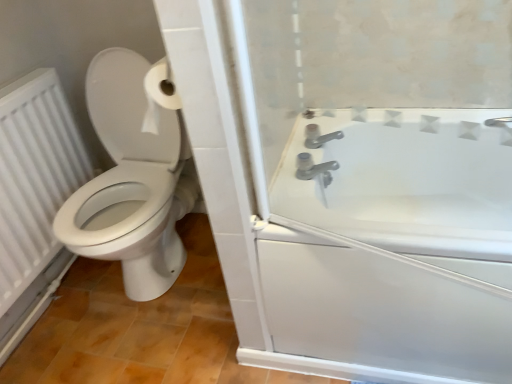
Measure the distance between satin nickel faucet at upper right and camera.

satin nickel faucet at upper right and camera are 4.01 feet apart.

Where is `satin nickel faucet at upper right`? satin nickel faucet at upper right is located at coordinates (314, 168).

From a real-world perspective, does white glossy bathtub at right sit lower than satin nickel faucet at upper right?

Yes, from a real-world perspective, white glossy bathtub at right is beneath satin nickel faucet at upper right.

At what (x,y) coordinates should I click in order to perform the action: click on screen door that appears below the satin nickel faucet at upper right (from a real-world perspective). Please return your answer as a coordinate pair (x, y). Looking at the image, I should click on coord(379,186).

Can you confirm if white glossy bathtub at right is wider than satin nickel faucet at upper right?

Correct, the width of white glossy bathtub at right exceeds that of satin nickel faucet at upper right.

Is white glossy bathtub at right at the right side of satin nickel faucet at upper right?

Yes, white glossy bathtub at right is to the right of satin nickel faucet at upper right.

Is white textured radiator at left situated inside white glossy bathtub at right or outside?

white textured radiator at left is spatially situated outside white glossy bathtub at right.

Which object is closer to the camera taking this photo, white textured radiator at left or white glossy bathtub at right?

white glossy bathtub at right is more forward.

From the image's perspective, is white textured radiator at left below white glossy bathtub at right?

Actually, white textured radiator at left appears above white glossy bathtub at right in the image.

Is white textured radiator at left taller than white glossy bathtub at right?

Indeed, white textured radiator at left has a greater height compared to white glossy bathtub at right.

Is white textured radiator at left completely or partially outside of satin nickel faucet at upper right?

white textured radiator at left lies outside satin nickel faucet at upper right's area.

Does point (45, 211) come closer to viewer compared to point (311, 169)?

No, it is behind (311, 169).

Which object is positioned more to the right, white textured radiator at left or satin nickel faucet at upper right?

From the viewer's perspective, satin nickel faucet at upper right appears more on the right side.

Is satin nickel faucet at upper right not inside white glossy bathtub at right?

satin nickel faucet at upper right is positioned outside white glossy bathtub at right.

Based on the photo, how many degrees apart are the facing directions of satin nickel faucet at upper right and white glossy bathtub at right?

There is a 91.1-degree angle between the facing directions of satin nickel faucet at upper right and white glossy bathtub at right.

From a real-world perspective, is satin nickel faucet at upper right positioned under white glossy bathtub at right based on gravity?

No.

Which object is more forward, satin nickel faucet at upper right or white textured radiator at left?

white textured radiator at left is in front.

Can you confirm if satin nickel faucet at upper right is shorter than white textured radiator at left?

Yes.

Is point (309, 156) less distant than point (18, 182)?

Yes, point (309, 156) is closer to viewer.

Is satin nickel faucet at upper right bigger than white textured radiator at left?

Actually, satin nickel faucet at upper right might be smaller than white textured radiator at left.

Is white glossy bathtub at right not inside white textured radiator at left?

Yes, white glossy bathtub at right is located beyond the bounds of white textured radiator at left.

Is white glossy bathtub at right aimed at white textured radiator at left?

No, white glossy bathtub at right is not facing towards white textured radiator at left.

Does white glossy bathtub at right have a lesser width compared to white textured radiator at left?

No.

Identify the location of tap above the white glossy bathtub at right (from a real-world perspective). The image size is (512, 384). (314, 168).

In order to click on screen door that is in front of the white textured radiator at left in this screenshot , I will do [x=379, y=186].

Based on their spatial positions, is satin nickel faucet at upper right or white textured radiator at left further from white glossy bathtub at right?

Based on the image, white textured radiator at left appears to be further to white glossy bathtub at right.

Estimate the real-world distances between objects in this image. Which object is closer to white textured radiator at left, satin nickel faucet at upper right or white glossy bathtub at right?

satin nickel faucet at upper right is positioned closer to the anchor white textured radiator at left.

In the scene shown: When comparing their distances from white textured radiator at left, does white glossy bathtub at right or satin nickel faucet at upper right seem closer?

satin nickel faucet at upper right is closer to white textured radiator at left.

Consider the image. Considering their positions, is white glossy bathtub at right positioned closer to satin nickel faucet at upper right than white textured radiator at left?

white glossy bathtub at right lies closer to satin nickel faucet at upper right than the other object.

In the scene shown: Based on their spatial positions, is white textured radiator at left or white glossy bathtub at right closer to satin nickel faucet at upper right?

white glossy bathtub at right is positioned closer to the anchor satin nickel faucet at upper right.

When comparing their distances from white glossy bathtub at right, does white textured radiator at left or satin nickel faucet at upper right seem further?

white textured radiator at left.

The height and width of the screenshot is (384, 512). I want to click on tap situated between white textured radiator at left and white glossy bathtub at right from left to right, so click(x=314, y=168).